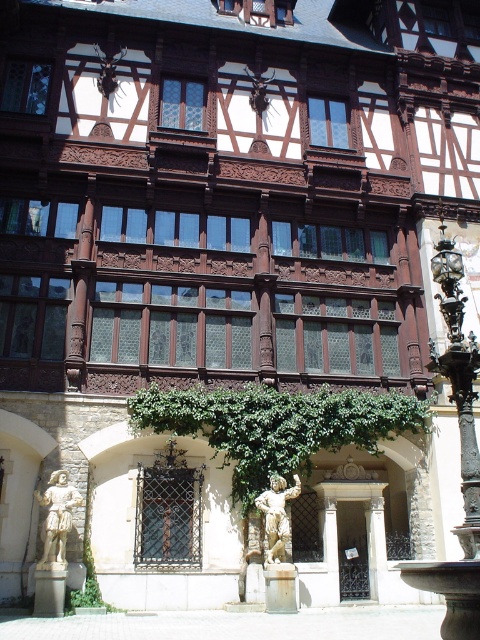
Based on the photo, you are standing in front of a historic building with half timbered architecture. You see a point at coordinate (276, 515). What is located at this point?

The point at coordinate (276, 515) marks the location of a stone statue at center.